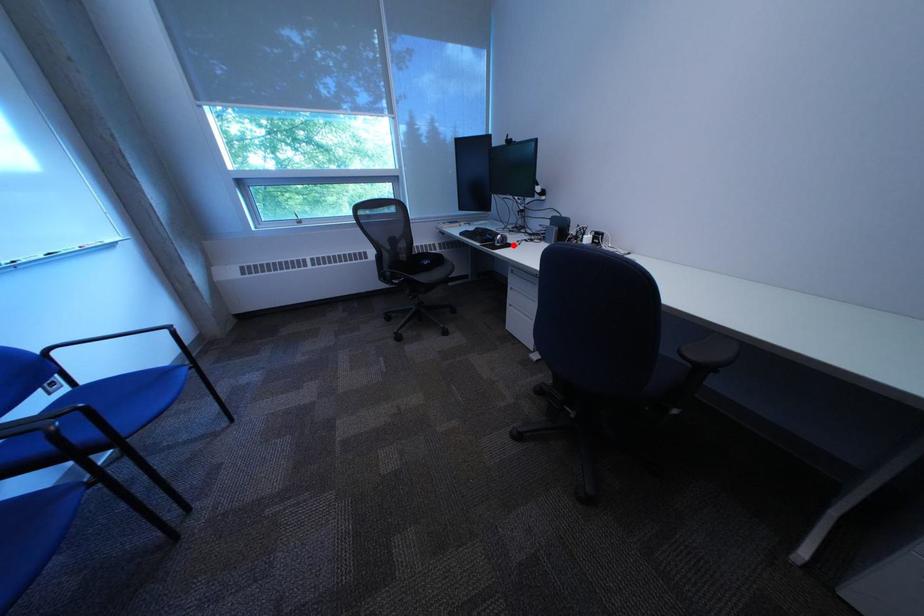
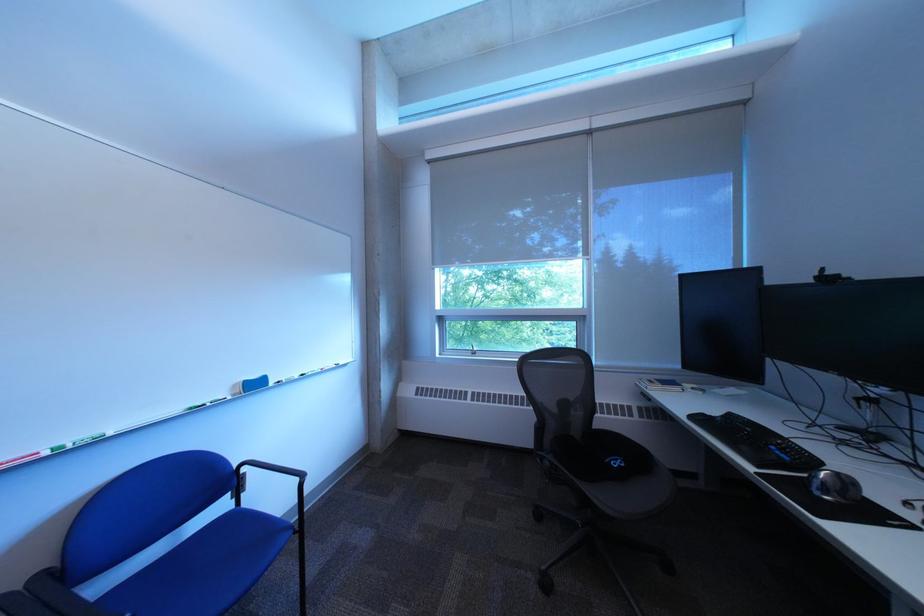
In the second image, find the point that corresponds to the highlighted location in the first image.

(841, 493)